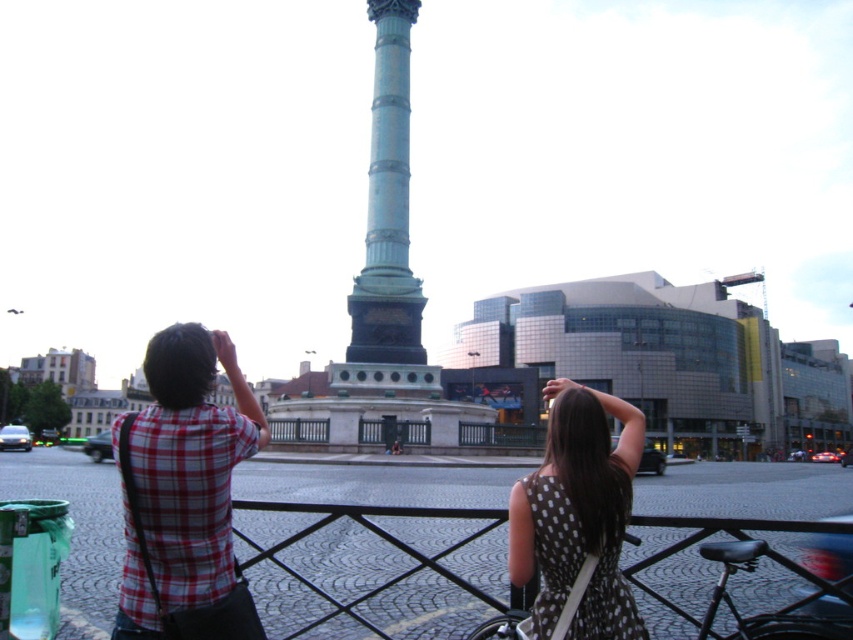
Question: Which object is positioned closest to the polka dot dress at center?

Choices:
 (A) red plaid shirt at left
 (B) green polished column at center

Answer: (A)

Question: Does polka dot dress at center have a smaller size compared to green polished column at center?

Choices:
 (A) no
 (B) yes

Answer: (A)

Question: Which point is closer to the camera?

Choices:
 (A) green polished column at center
 (B) polka dot dress at center

Answer: (B)

Question: Is polka dot dress at center below green polished column at center?

Choices:
 (A) yes
 (B) no

Answer: (A)

Question: Which of the following is the farthest from the observer?

Choices:
 (A) red plaid shirt at left
 (B) polka dot dress at center

Answer: (B)

Question: Can you confirm if red plaid shirt at left is thinner than green polished column at center?

Choices:
 (A) no
 (B) yes

Answer: (A)